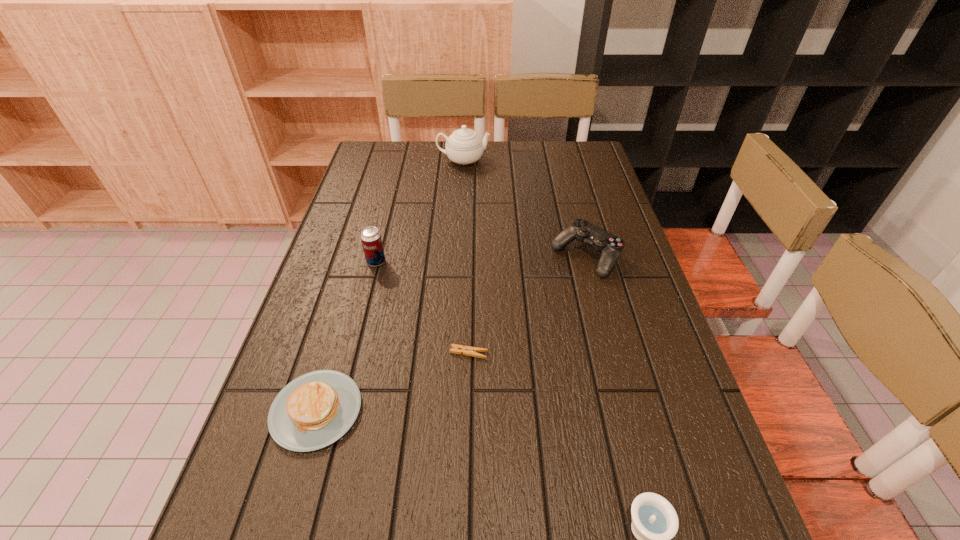
The image size is (960, 540). Identify the location of object that is the second closest to the second nearest object. (371, 240).

Where is `vacant space that satisfies the following two spatial constraints: 1. on the spout of the fourth farthest object; 2. on the right side of the tallest object`? The width and height of the screenshot is (960, 540). vacant space that satisfies the following two spatial constraints: 1. on the spout of the fourth farthest object; 2. on the right side of the tallest object is located at coordinates (453, 353).

Identify the location of free spot that satisfies the following two spatial constraints: 1. on the spout of the farthest object; 2. on the back side of the shortest object. This screenshot has height=540, width=960. (453, 353).

I want to click on vacant region that satisfies the following two spatial constraints: 1. on the spout of the farthest object; 2. on the back side of the shortest object, so click(x=453, y=353).